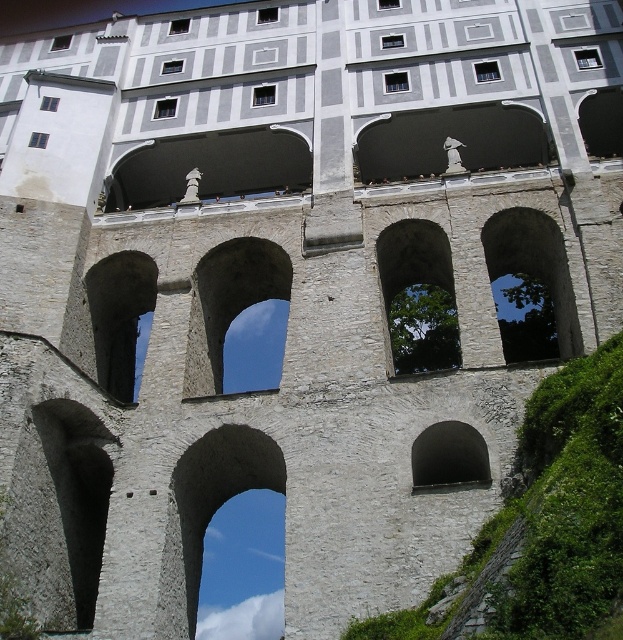
Which is in front, point (525, 404) or point (239, 285)?

Point (525, 404) is in front.

Locate an element on the screen. green mossy hillside at lower right is located at coordinates (545, 518).

Is point (581, 600) positioned before point (206, 358)?

Yes, point (581, 600) is in front of point (206, 358).

The image size is (623, 640). I want to click on green mossy hillside at lower right, so click(x=545, y=518).

How far apart are green mossy hillside at lower right and black stone archway at center?

35.45 feet

The image size is (623, 640). Identify the location of green mossy hillside at lower right. (545, 518).

This screenshot has width=623, height=640. I want to click on green mossy hillside at lower right, so click(545, 518).

Between green mossy hillside at lower right and gray stone archway at center, which one appears on the right side from the viewer's perspective?

From the viewer's perspective, green mossy hillside at lower right appears more on the right side.

Does green mossy hillside at lower right appear under gray stone archway at center?

No, green mossy hillside at lower right is not below gray stone archway at center.

Is point (591, 512) behind point (249, 470)?

No, (591, 512) is in front of (249, 470).

Identify the location of green mossy hillside at lower right. (545, 518).